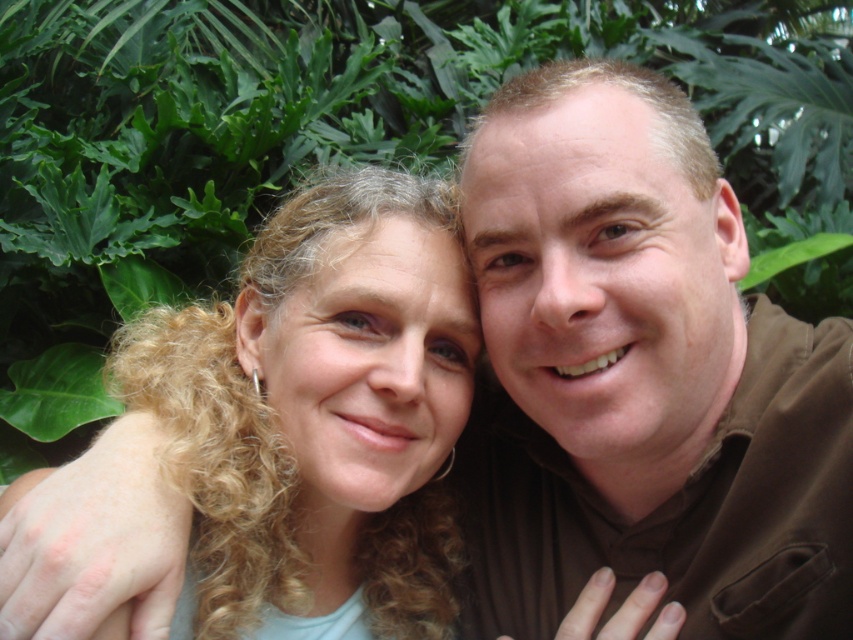
Who is positioned more to the right, brown smooth shirt at center or curly blonde hair at center?

brown smooth shirt at center is more to the right.

Can you confirm if brown smooth shirt at center is smaller than curly blonde hair at center?

No, brown smooth shirt at center is not smaller than curly blonde hair at center.

Is point (654, 316) positioned after point (323, 221)?

No, (654, 316) is in front of (323, 221).

This screenshot has height=640, width=853. Identify the location of brown smooth shirt at center. (642, 376).